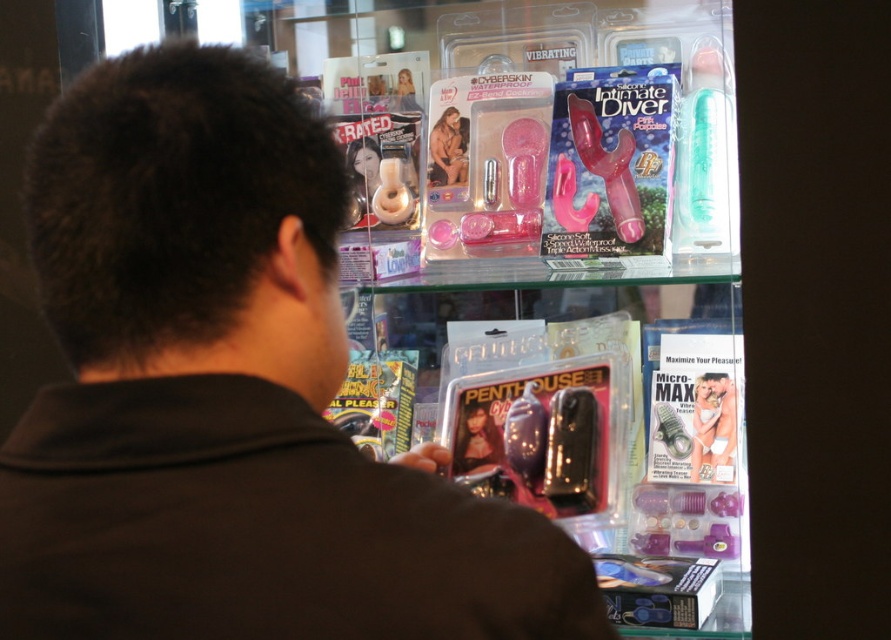
You are a delivery person who needs to place a new package between the black matte shirt at upper left and the matte plastic barbie at upper center. The package is 12 inches long. Can you fit it in the space between them?

The distance between the black matte shirt at upper left and the matte plastic barbie at upper center is 33.79 inches, so yes, the 12 inch package can fit in the space between them.

What is the color of the clothing item located at the coordinates point (229, 396) in the image?

The point (229, 396) marks the black matte shirt at upper left, so the color is black.